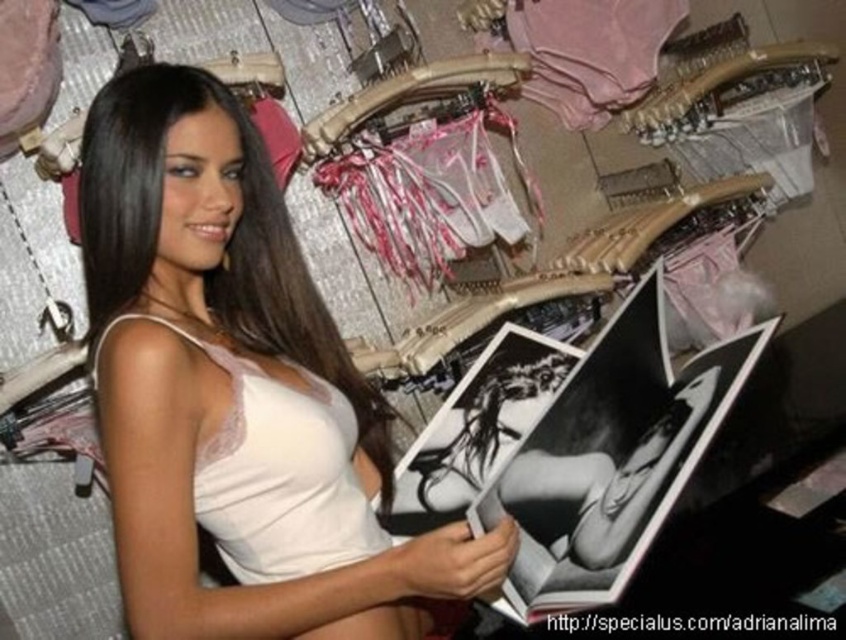
What is located at the coordinates point (224, 369) in the image?

The white satin bra at center is located at point (224, 369).

You are a photographer setting up for a lingerie catalog shoot in the store. You have two points marked on the camera screen for reference. The first point is at coordinates point (x=378, y=468) and the second point is at point (x=222, y=356). Which point is closer to the camera lens?

Point (x=378, y=468) is further to the viewer than point (x=222, y=356), so the second point at (x=222, y=356) is closer to the camera lens.

In the scene shown: You are a customer in the store and want to find the white satin bra at center. The store uses a coordinate system where the bottom left corner is the origin. Can you tell me its location in terms of coordinates?

The white satin bra at center is located at coordinates approximately 0.577 on the x axis and 0.266 on the y axis.